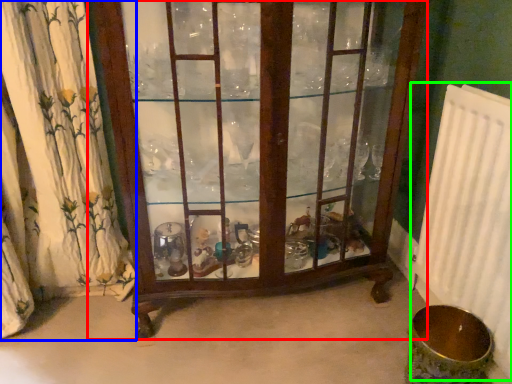
Question: Which is farther away from furniture (highlighted by a red box)? curtain (highlighted by a blue box) or radiator (highlighted by a green box)?

Choices:
 (A) curtain
 (B) radiator

Answer: (B)